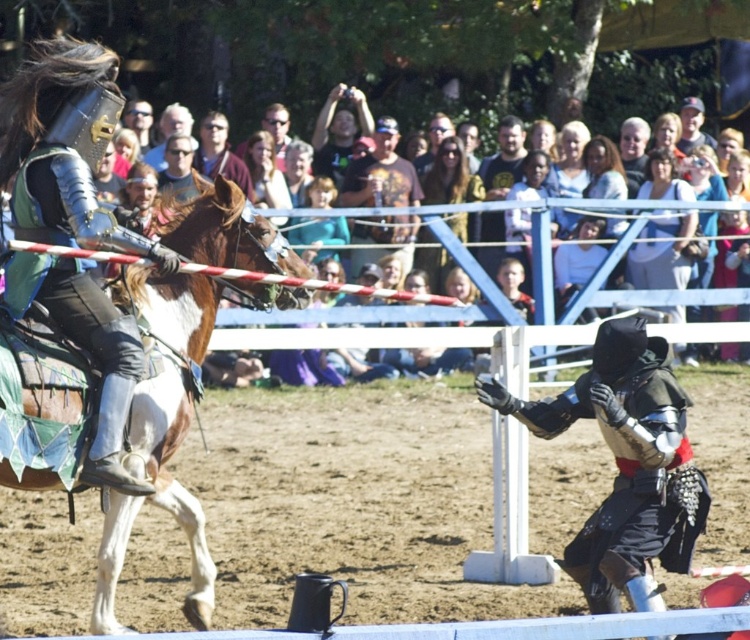
Image resolution: width=750 pixels, height=640 pixels. What do you see at coordinates (170, 474) in the screenshot?
I see `brown glossy horse at left` at bounding box center [170, 474].

Between brown glossy horse at left and brown leather jacket at center, which one has less height?

With less height is brown leather jacket at center.

Is point (207, 257) closer to camera compared to point (375, 205)?

Yes, it is in front of point (375, 205).

The width and height of the screenshot is (750, 640). I want to click on brown glossy horse at left, so click(x=170, y=474).

Is shiny black armor at center closer to the viewer compared to brown glossy horse at left?

No, it is not.

Does shiny black armor at center have a greater height compared to brown glossy horse at left?

No.

Image resolution: width=750 pixels, height=640 pixels. I want to click on shiny black armor at center, so click(x=626, y=465).

This screenshot has height=640, width=750. What are the coordinates of `shiny black armor at center` in the screenshot? It's located at (626, 465).

Is shiny black armor at center bigger than brown leather jacket at center?

Yes, shiny black armor at center is bigger than brown leather jacket at center.

Can you confirm if shiny black armor at center is positioned to the left of brown leather jacket at center?

In fact, shiny black armor at center is to the right of brown leather jacket at center.

Looking at this image, who is more distant from viewer, [597,408] or [375,136]?

The point [375,136] is more distant.

The height and width of the screenshot is (640, 750). I want to click on shiny black armor at center, so click(626, 465).